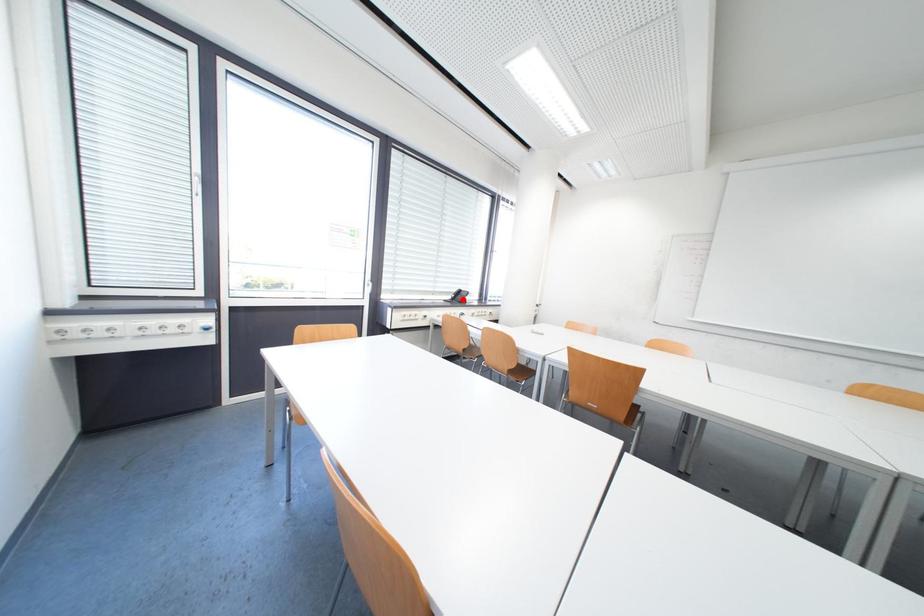
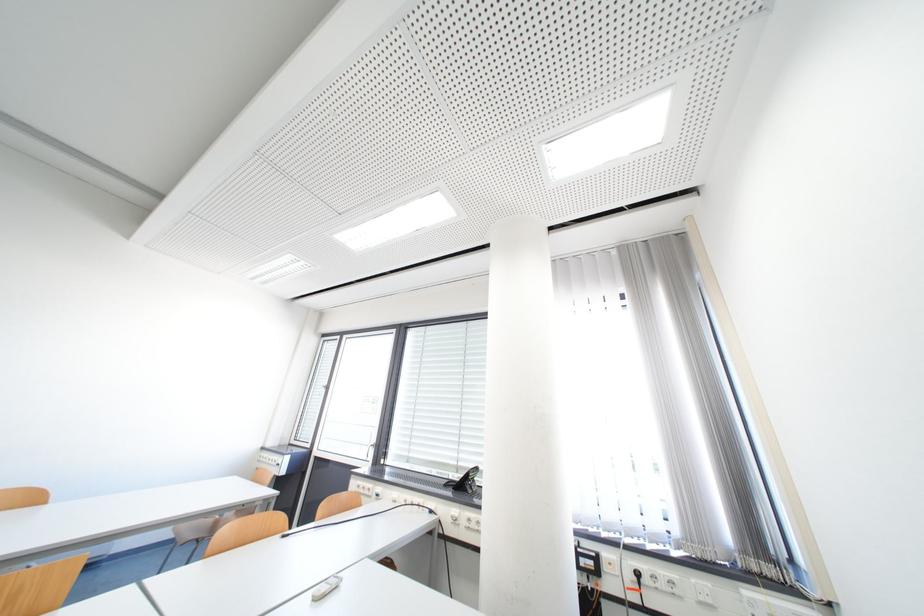
Question: I am providing you with two images of the same scene from different viewpoints. A red point is marked on the first image. At the location where the point appears in image 1, is it still visible in image 2?

Choices:
 (A) Yes
 (B) No

Answer: (A)